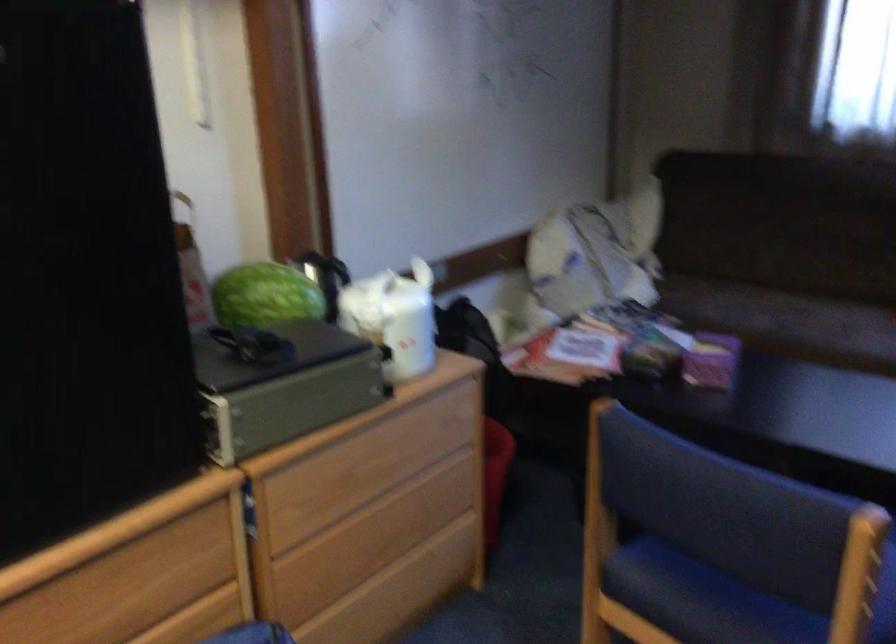
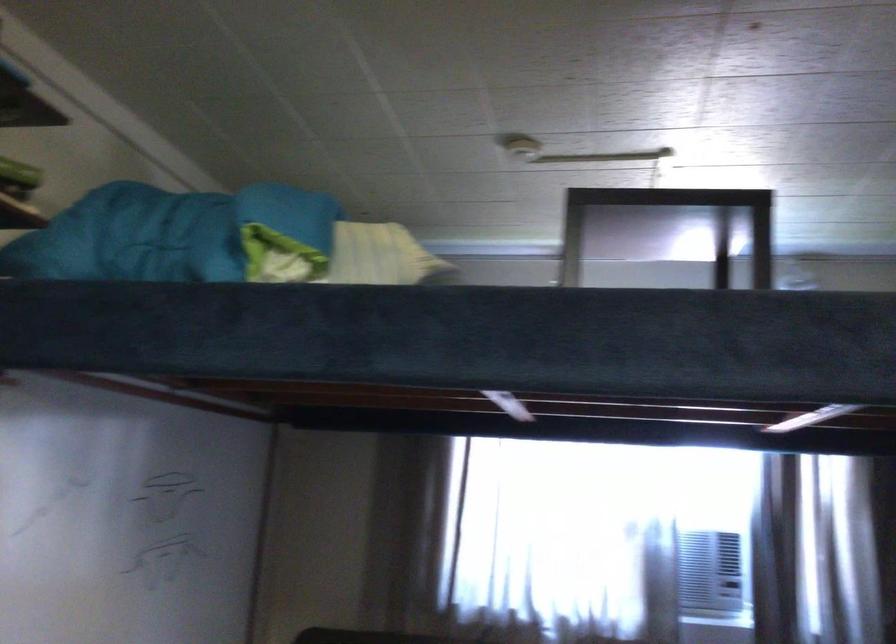
The first image is from the beginning of the video and the second image is from the end. How did the camera likely rotate when shooting the video?

The camera rotated toward right-up.